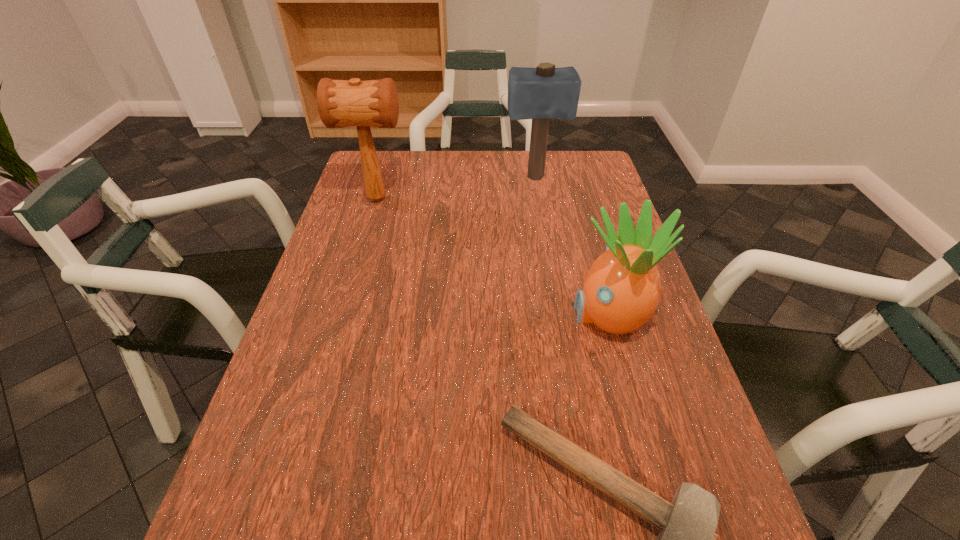
The height and width of the screenshot is (540, 960). I want to click on mallet that stands as the closest to the third farthest object, so click(687, 538).

I want to click on mallet that is the third closest to the third farthest object, so click(x=341, y=103).